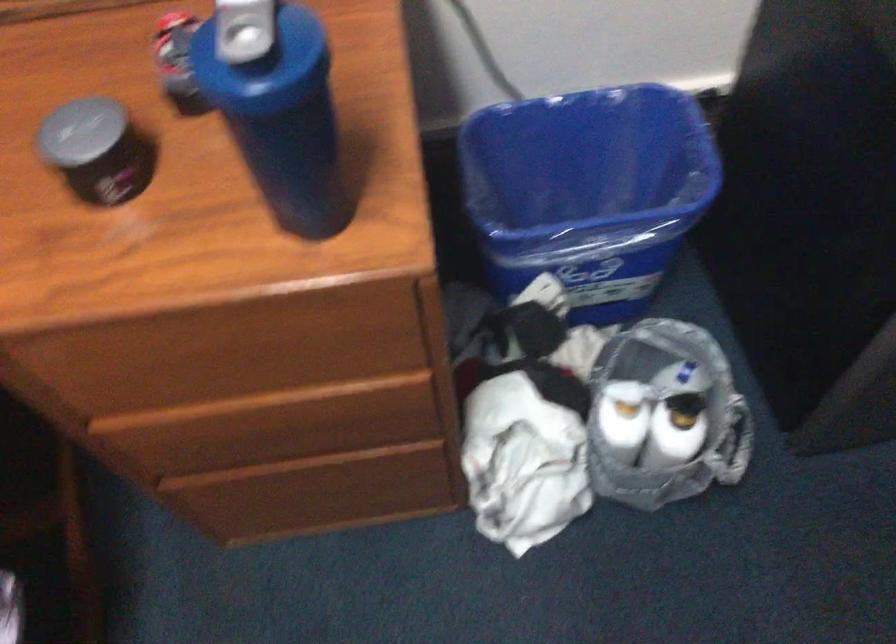
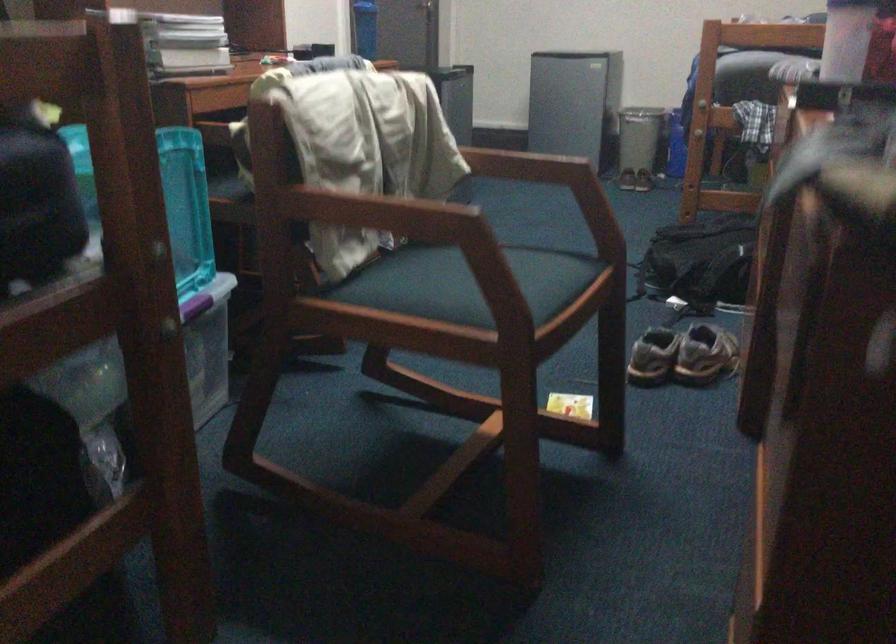
Question: I am providing you with two images of the same scene from different viewpoints. Which of the following objects are not visible in image2?

Choices:
 (A) chair sitting surface
 (B) drawer handle
 (C) silver trash can
 (D) green cap marker

Answer: (B)